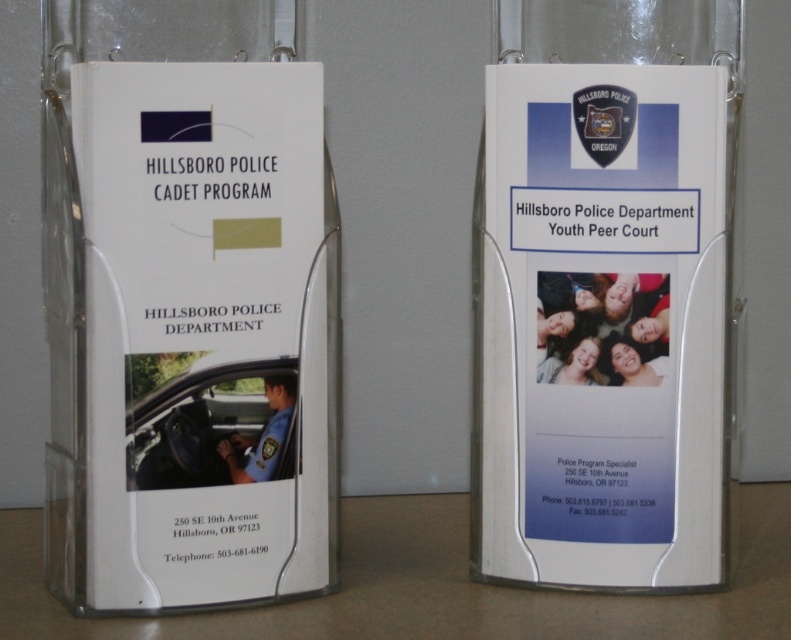
Is white plastic brochure at right wider than white plastic table at lower center?

No, white plastic brochure at right is not wider than white plastic table at lower center.

Between white plastic brochure at right and white plastic table at lower center, which one is positioned lower?

Positioned lower is white plastic table at lower center.

Does point (610, 113) come behind point (746, 540)?

No, (610, 113) is closer to viewer.

Find the location of `white plastic brochure at right`. white plastic brochure at right is located at coordinates (604, 294).